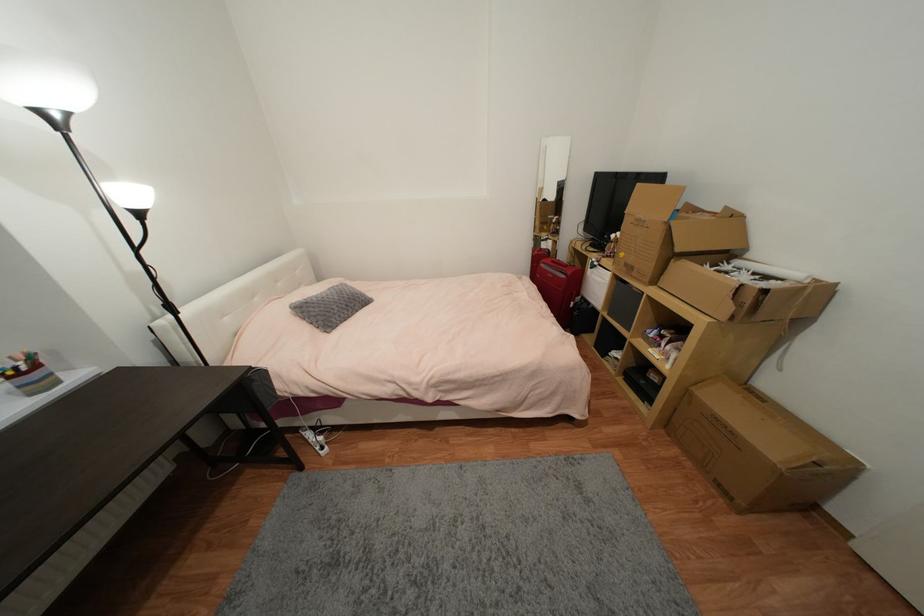
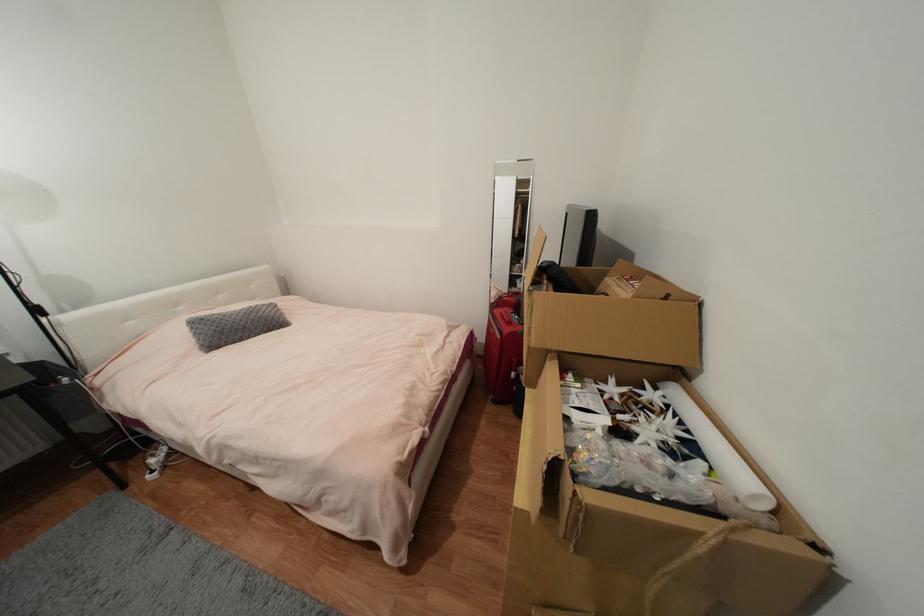
The point at (577, 305) is marked in the first image. Where is the corresponding point in the second image?

(517, 375)